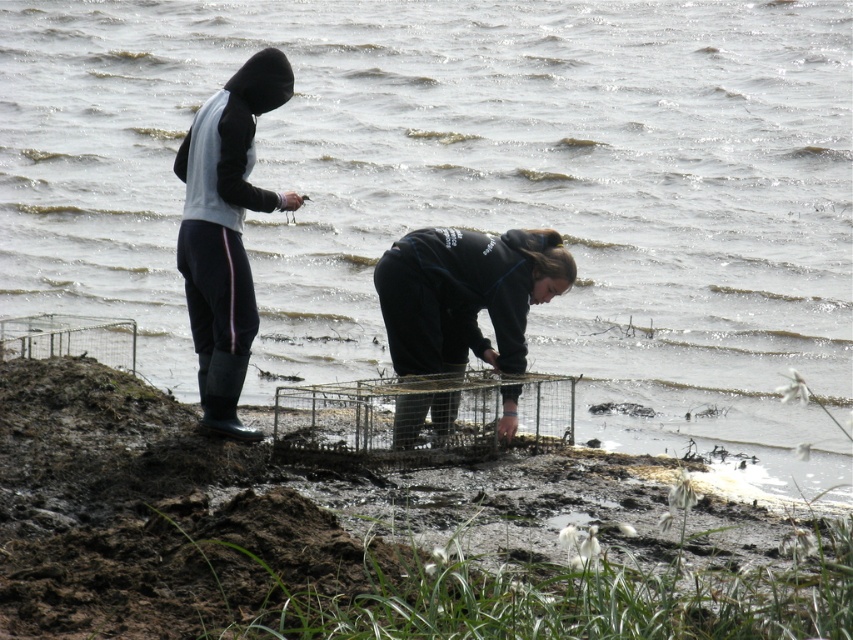
Can you confirm if rubber boots at left is bigger than metallic wire birdcage at center?

Actually, rubber boots at left might be smaller than metallic wire birdcage at center.

Is rubber boots at left positioned behind metallic wire birdcage at center?

Yes, it is.

This screenshot has width=853, height=640. I want to click on rubber boots at left, so click(x=225, y=230).

The width and height of the screenshot is (853, 640). Identify the location of rubber boots at left. (225, 230).

This screenshot has width=853, height=640. What do you see at coordinates (465, 294) in the screenshot?
I see `black matte jacket at lower center` at bounding box center [465, 294].

Locate an element on the screen. black matte jacket at lower center is located at coordinates (465, 294).

Can you confirm if black matte jacket at lower center is positioned to the right of metallic wire birdcage at center?

Indeed, black matte jacket at lower center is positioned on the right side of metallic wire birdcage at center.

Who is taller, black matte jacket at lower center or metallic wire birdcage at center?

Standing taller between the two is black matte jacket at lower center.

What do you see at coordinates (465, 294) in the screenshot? I see `black matte jacket at lower center` at bounding box center [465, 294].

The height and width of the screenshot is (640, 853). Find the location of `black matte jacket at lower center`. black matte jacket at lower center is located at coordinates (465, 294).